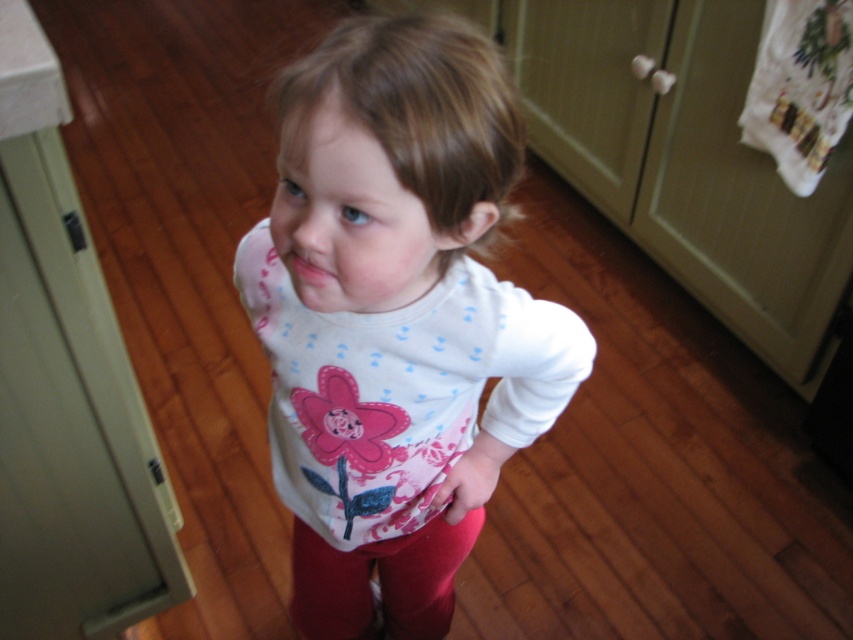
Can you confirm if smooth skin face at center is positioned above pink matte lips at center?

Yes.

Can you confirm if smooth skin face at center is shorter than pink matte lips at center?

No, smooth skin face at center is not shorter than pink matte lips at center.

Where is `smooth skin face at center`? The width and height of the screenshot is (853, 640). smooth skin face at center is located at coordinates (352, 216).

Looking at this image, does white soft shirt at center appear under smooth skin face at center?

Yes, white soft shirt at center is below smooth skin face at center.

Is white soft shirt at center in front of smooth skin face at center?

Yes, it is.

Describe the element at coordinates (396, 320) in the screenshot. I see `white soft shirt at center` at that location.

Find the location of `white soft shirt at center`. white soft shirt at center is located at coordinates (396, 320).

Measure the distance between point (381, 422) and camera.

Point (381, 422) and camera are 32.77 inches apart from each other.

Does white soft shirt at center appear on the right side of pink matte lips at center?

Yes, white soft shirt at center is to the right of pink matte lips at center.

At what (x,y) coordinates should I click in order to perform the action: click on white soft shirt at center. Please return your answer as a coordinate pair (x, y). Looking at the image, I should click on (396, 320).